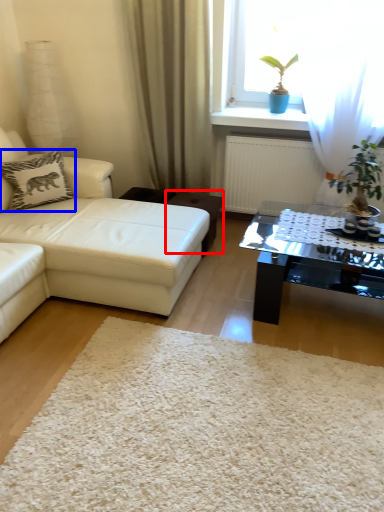
Question: Among these objects, which one is farthest to the camera, stool (highlighted by a red box) or pillow (highlighted by a blue box)?

Choices:
 (A) stool
 (B) pillow

Answer: (A)